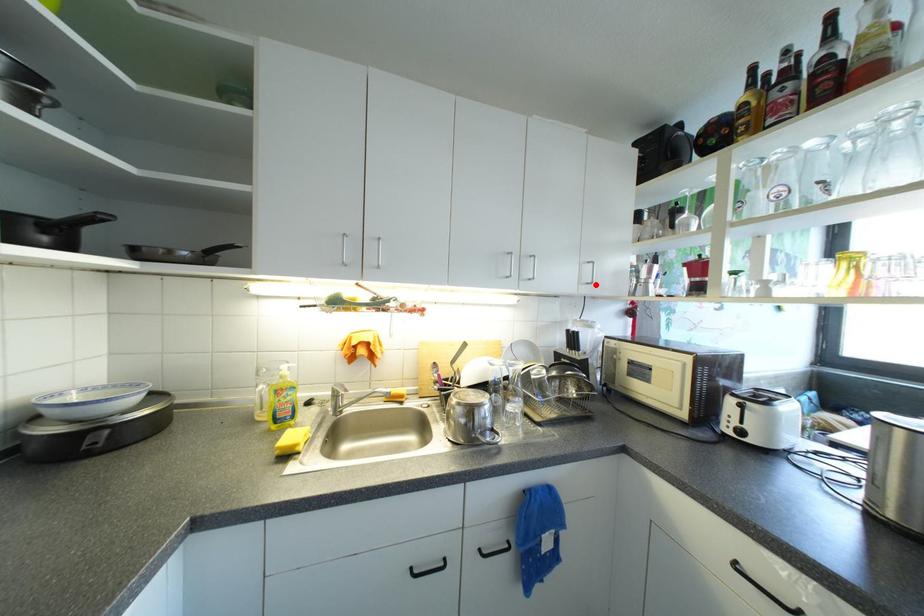
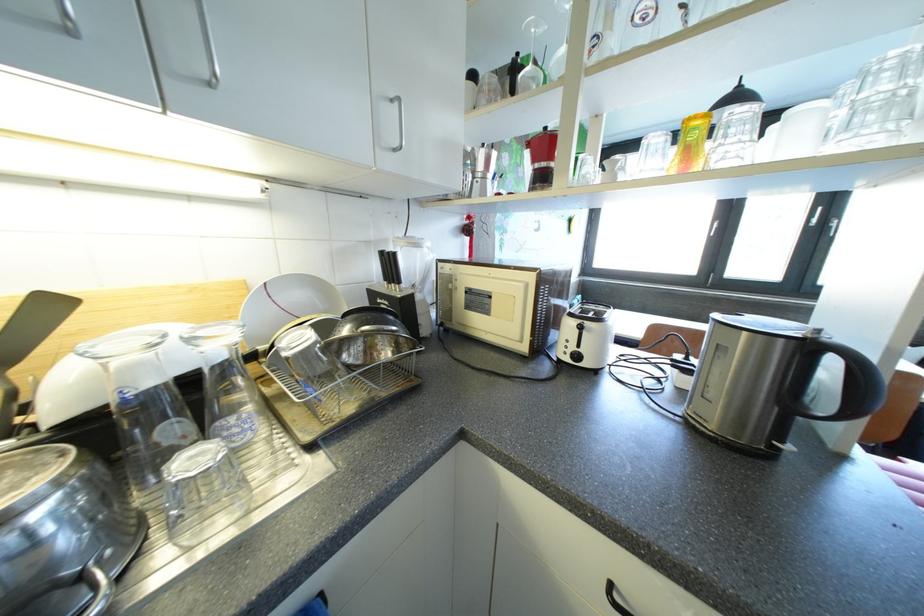
Locate, in the second image, the point that corresponds to the highlighted location in the first image.

(403, 146)